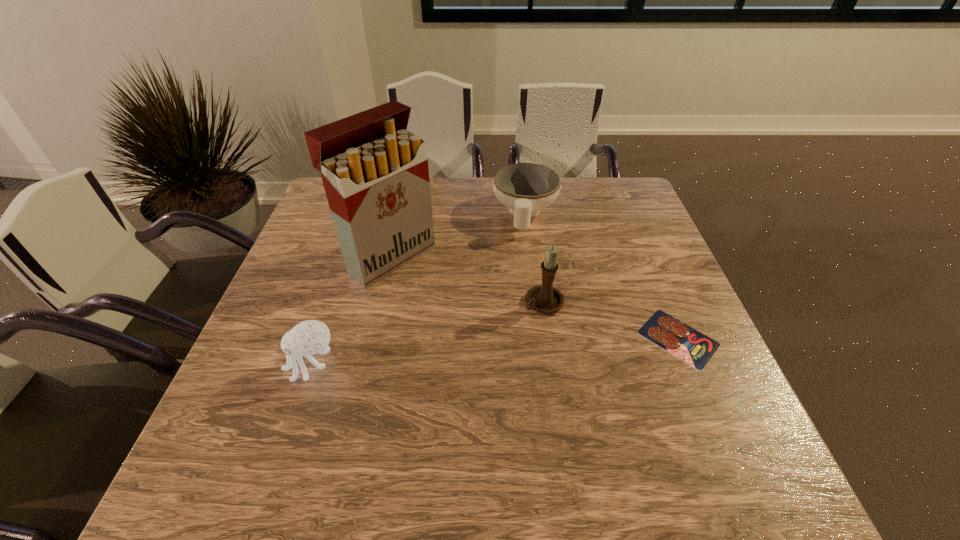
Identify the location of vacant space on the desktop that is between the octopus and the rightmost object and is positioned with the lid open on the tallest object. (520, 350).

Identify the location of free space on the desktop that is between the octopus and the rightmost object and is positioned on the side with the handle of the fourth tallest object. (504, 351).

Locate an element on the screen. vacant spot on the desktop that is between the octopus and the salami and is positioned on the side of the second tallest object with the handle is located at coordinates (466, 354).